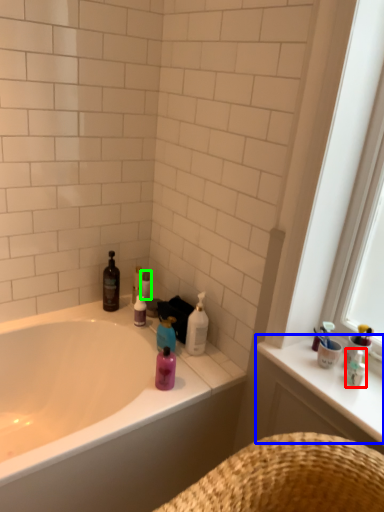
Question: Which object is the farthest from toiletry (highlighted by a red box)? Choose among these: counter top (highlighted by a blue box) or toilet paper (highlighted by a green box).

Choices:
 (A) counter top
 (B) toilet paper

Answer: (B)